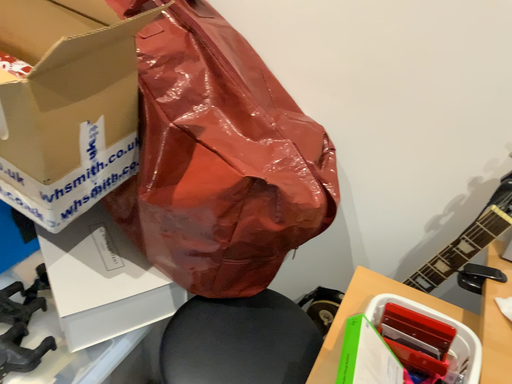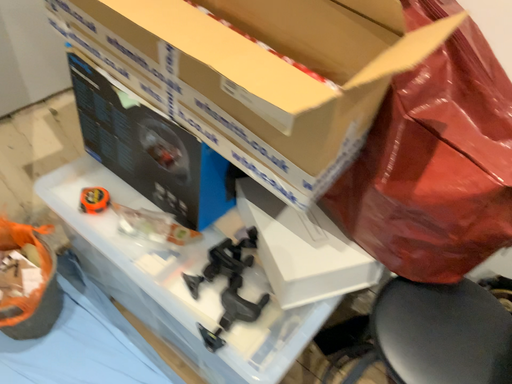
Question: Which way did the camera rotate in the video?

Choices:
 (A) rotated right
 (B) rotated left

Answer: (B)